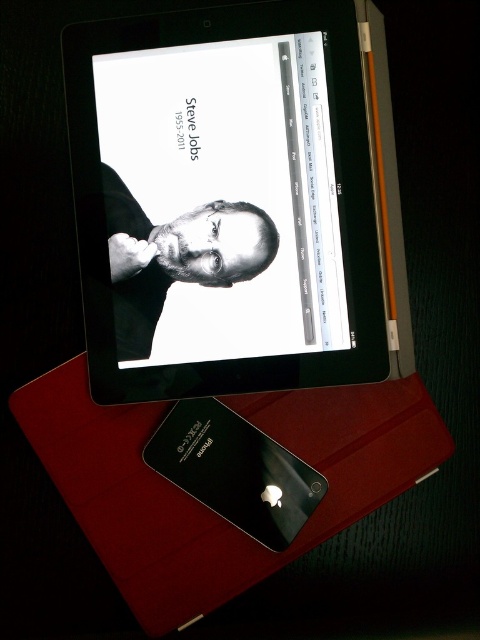
You are taking a photo of the tablet and iPhone setup. There are two points marked in the image at coordinates point (214,259) and point (217,513). Which point will appear closer to the camera in the photo?

Point (217,513) will appear closer to the camera in the photo because it is physically closer to the camera than point (214,259), which is further away.

You are holding a smartphone and looking at the scene. Which object is nearer to you between the black glossy tablet at upper center and the black matte portrait at center?

The black glossy tablet at upper center is closer to the viewer than the black matte portrait at center.